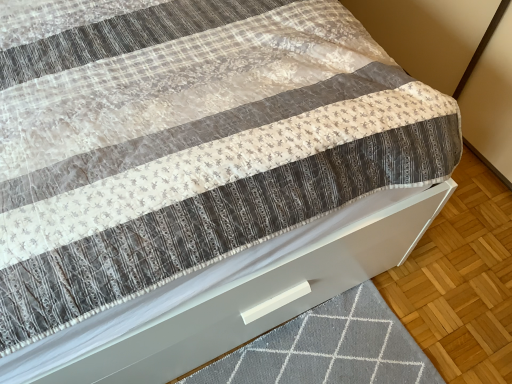
What do you see at coordinates (327, 348) in the screenshot?
I see `gray woven doormat at lower center` at bounding box center [327, 348].

Where is `gray woven doormat at lower center`? gray woven doormat at lower center is located at coordinates (327, 348).

I want to click on gray woven doormat at lower center, so [327, 348].